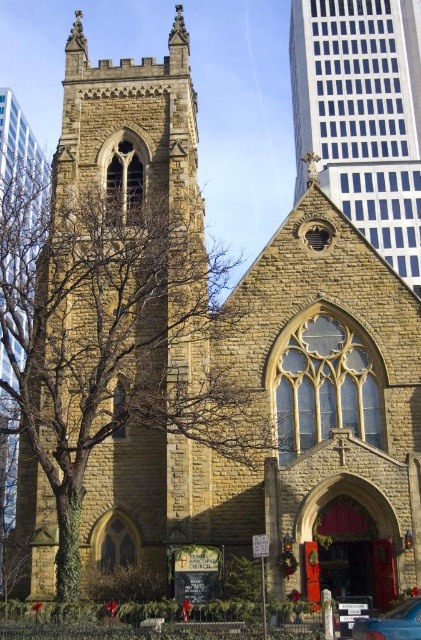
Question: Estimate the real-world distances between objects in this image. Which object is closer to the brown stone tree at left?

Choices:
 (A) metallic blue car at lower right
 (B) stone church tower at center

Answer: (A)

Question: Can you confirm if brown stone tree at left is thinner than stone church tower at center?

Choices:
 (A) yes
 (B) no

Answer: (B)

Question: Is stone church tower at center above metallic blue car at lower right?

Choices:
 (A) yes
 (B) no

Answer: (A)

Question: Estimate the real-world distances between objects in this image. Which object is farther from the metallic blue car at lower right?

Choices:
 (A) stone church tower at center
 (B) brown stone tree at left

Answer: (A)

Question: Does stone church tower at center have a lesser width compared to metallic blue car at lower right?

Choices:
 (A) yes
 (B) no

Answer: (B)

Question: Which point is closer to the camera?

Choices:
 (A) (333, 76)
 (B) (352, 637)

Answer: (B)